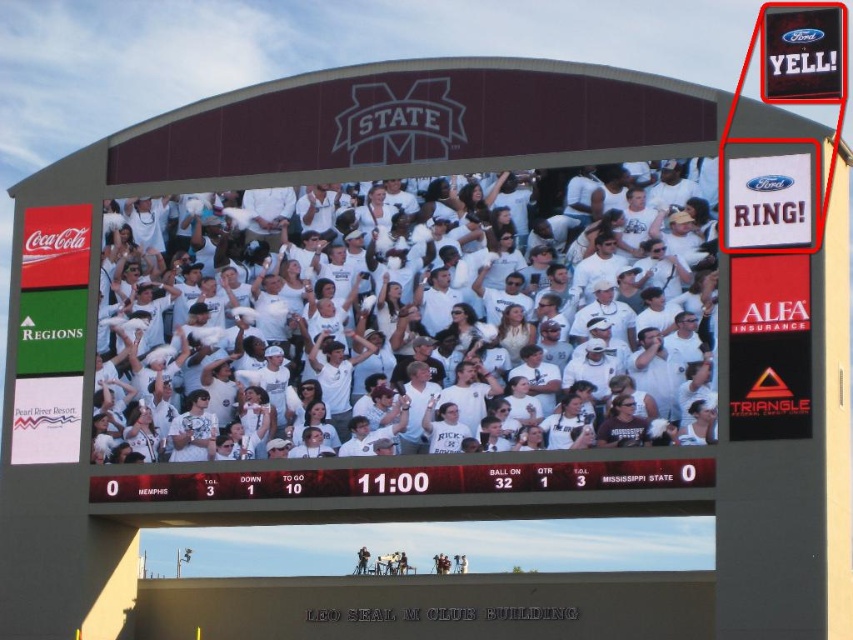
Question: Which of the following is the farthest from the observer?

Choices:
 (A) (44, 304)
 (B) (813, 45)
 (C) (207, 488)

Answer: (A)

Question: In this image, where is white paper coca-cola sign at left located relative to red plastic sign at upper right?

Choices:
 (A) below
 (B) above

Answer: (A)

Question: Which point appears closest to the camera in this image?

Choices:
 (A) (160, 483)
 (B) (792, 61)
 (C) (86, 224)

Answer: (A)

Question: Is the position of white plastic scoreboard at center more distant than that of white paper coca-cola sign at left?

Choices:
 (A) no
 (B) yes

Answer: (A)

Question: Which point appears closest to the camera in this image?

Choices:
 (A) (822, 16)
 (B) (445, 493)

Answer: (B)

Question: Can you confirm if white plastic scoreboard at center is thinner than white paper coca-cola sign at left?

Choices:
 (A) no
 (B) yes

Answer: (A)